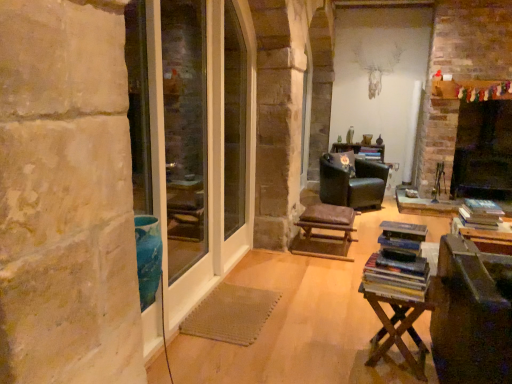
Question: Can you confirm if wooden table at lower right is thinner than clear glass door at left, the second screen door when ordered from right to left?

Choices:
 (A) no
 (B) yes

Answer: (A)

Question: From a real-world perspective, is wooden table at lower right positioned under clear glass door at left, the second screen door when ordered from right to left, based on gravity?

Choices:
 (A) no
 (B) yes

Answer: (B)

Question: From a real-world perspective, is wooden table at lower right positioned over clear glass door at left, the first screen door viewed from the left, based on gravity?

Choices:
 (A) no
 (B) yes

Answer: (A)

Question: Are wooden table at lower right and clear glass door at left, the second screen door when ordered from right to left, making contact?

Choices:
 (A) yes
 (B) no

Answer: (B)

Question: From the image's perspective, is wooden table at lower right below clear glass door at left, the first screen door viewed from the left?

Choices:
 (A) yes
 (B) no

Answer: (A)

Question: Is clear glass screen door at left, marked as the 1th screen door in a right-to-left arrangement, inside the boundaries of clear glass door at left, the second screen door when ordered from right to left, or outside?

Choices:
 (A) outside
 (B) inside

Answer: (B)

Question: Relative to clear glass door at left, the second screen door when ordered from right to left, is clear glass screen door at left, marked as the 1th screen door in a right-to-left arrangement, in front or behind?

Choices:
 (A) front
 (B) behind

Answer: (A)

Question: From the image's perspective, is clear glass screen door at left, marked as the 1th screen door in a right-to-left arrangement, positioned above or below clear glass door at left, the first screen door viewed from the left?

Choices:
 (A) below
 (B) above

Answer: (B)

Question: From a real-world perspective, is clear glass screen door at left, which is the 2th screen door in left-to-right order, above or below clear glass door at left, the first screen door viewed from the left?

Choices:
 (A) below
 (B) above

Answer: (B)

Question: From the image's perspective, is brown leather stool at center located above or below black matte fireplace at right?

Choices:
 (A) above
 (B) below

Answer: (B)

Question: From their relative heights in the image, would you say brown leather stool at center is taller or shorter than black matte fireplace at right?

Choices:
 (A) short
 (B) tall

Answer: (A)

Question: Is point (340, 213) closer or farther from the camera than point (482, 190)?

Choices:
 (A) farther
 (B) closer

Answer: (B)

Question: Would you say brown leather stool at center is to the left or to the right of black matte fireplace at right in the picture?

Choices:
 (A) left
 (B) right

Answer: (A)

Question: From a real-world perspective, is wooden table at lower right physically located above or below brown leather stool at center?

Choices:
 (A) above
 (B) below

Answer: (A)

Question: Considering the relative positions of wooden table at lower right and brown leather stool at center in the image provided, is wooden table at lower right to the left or to the right of brown leather stool at center?

Choices:
 (A) left
 (B) right

Answer: (B)